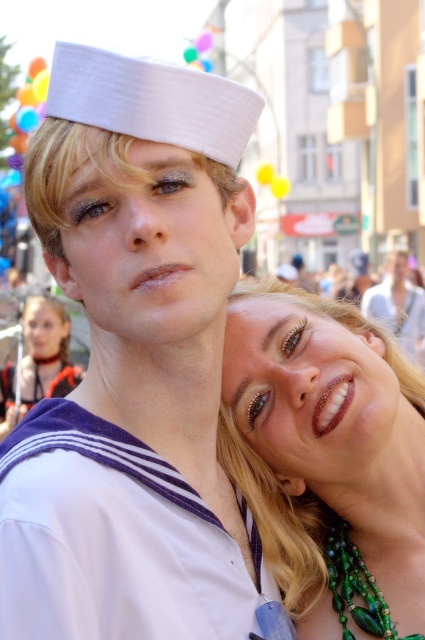
What is the 2D coordinate of the green beaded necklace at upper right in the image?

The green beaded necklace at upper right is located at the 2D coordinate point of (326, 460).

You are a photographer trying to capture a clear shot of the matte black hair at upper left and the green beaded necklace at lower right. Which object should you focus on first if you want to ensure both are in focus, considering their heights?

The matte black hair at upper left is not as tall as the green beaded necklace at lower right, so you should focus on the green beaded necklace at lower right first since it is taller and will require adjusting the focus to include both objects.

You are a photographer trying to capture the green beaded necklace at upper right and the green beaded necklace at lower right in a single shot. Which necklace is placed higher on the image?

The green beaded necklace at upper right is positioned over green beaded necklace at lower right, so it is higher in the image.